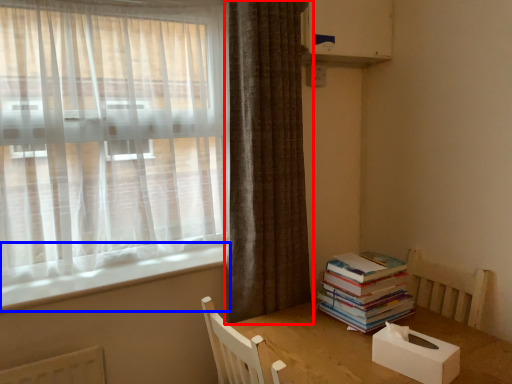
Question: Which object appears farthest to the camera in this image, curtain (highlighted by a red box) or window sill (highlighted by a blue box)?

Choices:
 (A) curtain
 (B) window sill

Answer: (A)